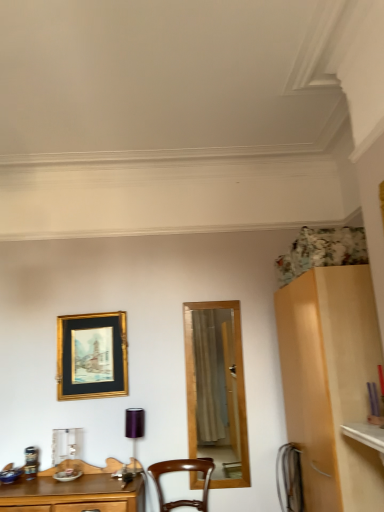
In order to face brown wooden chair at center, should I rotate leftwards or rightwards?

A 0.741 degree turn to the left will do.

This screenshot has width=384, height=512. What do you see at coordinates (181, 471) in the screenshot? I see `brown wooden chair at center` at bounding box center [181, 471].

Measure the distance between point (x=79, y=327) and camera.

Point (x=79, y=327) and camera are 10.74 feet apart from each other.

Where is `purple metallic lamp at center`? purple metallic lamp at center is located at coordinates (134, 428).

From a real-world perspective, between brown wooden chair at center and purple metallic lamp at center, who is vertically higher?

purple metallic lamp at center is physically above.

Between point (213, 465) and point (133, 443), which one is positioned in front?

The point (213, 465) is closer to the camera.

How far apart are brown wooden chair at center and purple metallic lamp at center?

The distance of brown wooden chair at center from purple metallic lamp at center is 15.62 inches.

Locate an element on the screen. The width and height of the screenshot is (384, 512). chair below the purple metallic lamp at center (from a real-world perspective) is located at coordinates (181, 471).

From the picture: Could you tell me if gold/glossy picture frame at upper left is facing brown wooden chair at center?

No, gold/glossy picture frame at upper left is not facing towards brown wooden chair at center.

What are the coordinates of `chair that is on the right side of gold/glossy picture frame at upper left` in the screenshot? It's located at (181, 471).

From a real-world perspective, does gold/glossy picture frame at upper left stand above brown wooden chair at center?

Yes, from a real-world perspective, gold/glossy picture frame at upper left is above brown wooden chair at center.

Is brown wooden chair at center located within gold/glossy picture frame at upper left?

That's incorrect, brown wooden chair at center is not inside gold/glossy picture frame at upper left.

Looking at this image, can you tell me how much purple metallic lamp at center and gold/glossy picture frame at upper left differ in facing direction?

The angular difference between purple metallic lamp at center and gold/glossy picture frame at upper left is 0.76 degrees.

Is purple metallic lamp at center to the left or to the right of gold/glossy picture frame at upper left in the image?

Based on their positions, purple metallic lamp at center is located to the right of gold/glossy picture frame at upper left.

Is purple metallic lamp at center looking in the opposite direction of gold/glossy picture frame at upper left?

That's not correct — purple metallic lamp at center is not looking away from gold/glossy picture frame at upper left.

Based on the photo, from the image's perspective, is purple metallic lamp at center over gold/glossy picture frame at upper left?

No, from the image's perspective, purple metallic lamp at center is not on top of gold/glossy picture frame at upper left.

Is brown wooden chair at center wider than gold/glossy picture frame at upper left?

Correct, the width of brown wooden chair at center exceeds that of gold/glossy picture frame at upper left.

From the image's perspective, between brown wooden chair at center and gold/glossy picture frame at upper left, who is located below?

brown wooden chair at center.

Does point (188, 504) come farther from viewer compared to point (83, 380)?

No, it is not.

How much distance is there between brown wooden chair at center and gold/glossy picture frame at upper left?

A distance of 87.13 centimeters exists between brown wooden chair at center and gold/glossy picture frame at upper left.

Does gold/glossy picture frame at upper left have a smaller size compared to purple metallic lamp at center?

Incorrect, gold/glossy picture frame at upper left is not smaller in size than purple metallic lamp at center.

Between point (73, 361) and point (133, 436), which one is positioned in front?

The point (133, 436) is closer to the camera.

Between gold/glossy picture frame at upper left and purple metallic lamp at center, which one has less height?

Standing shorter between the two is purple metallic lamp at center.

Is gold/glossy picture frame at upper left far from purple metallic lamp at center?

gold/glossy picture frame at upper left is near purple metallic lamp at center, not far away.

Considering the relative sizes of purple metallic lamp at center and brown wooden chair at center in the image provided, is purple metallic lamp at center wider than brown wooden chair at center?

No, purple metallic lamp at center is not wider than brown wooden chair at center.

From a real-world perspective, who is located lower, purple metallic lamp at center or brown wooden chair at center?

brown wooden chair at center.

Is purple metallic lamp at center placed right next to brown wooden chair at center?

They are not placed beside each other.

Measure the distance from purple metallic lamp at center to brown wooden chair at center.

purple metallic lamp at center is 15.62 inches from brown wooden chair at center.

Identify the location of chair on the right side of purple metallic lamp at center. The height and width of the screenshot is (512, 384). (181, 471).

Where is `picture frame above the brown wooden chair at center (from a real-world perspective)`? Image resolution: width=384 pixels, height=512 pixels. picture frame above the brown wooden chair at center (from a real-world perspective) is located at coordinates (92, 356).

When comparing their distances from purple metallic lamp at center, does brown wooden chair at center or gold/glossy picture frame at upper left seem closer?

Among the two, brown wooden chair at center is located nearer to purple metallic lamp at center.

Looking at the image, which one is located closer to brown wooden chair at center, gold/glossy picture frame at upper left or purple metallic lamp at center?

purple metallic lamp at center is positioned closer to the anchor brown wooden chair at center.

Looking at the image, which one is located closer to purple metallic lamp at center, gold/glossy picture frame at upper left or brown wooden chair at center?

brown wooden chair at center.

Which object lies further to the anchor point gold/glossy picture frame at upper left, brown wooden chair at center or purple metallic lamp at center?

The object further to gold/glossy picture frame at upper left is brown wooden chair at center.

Estimate the real-world distances between objects in this image. Which object is closer to brown wooden chair at center, purple metallic lamp at center or gold/glossy picture frame at upper left?

Based on the image, purple metallic lamp at center appears to be nearer to brown wooden chair at center.

Estimate the real-world distances between objects in this image. Which object is closer to gold/glossy picture frame at upper left, purple metallic lamp at center or brown wooden chair at center?

The object closer to gold/glossy picture frame at upper left is purple metallic lamp at center.

Image resolution: width=384 pixels, height=512 pixels. I want to click on lamp between gold/glossy picture frame at upper left and brown wooden chair at center in the vertical direction, so click(x=134, y=428).